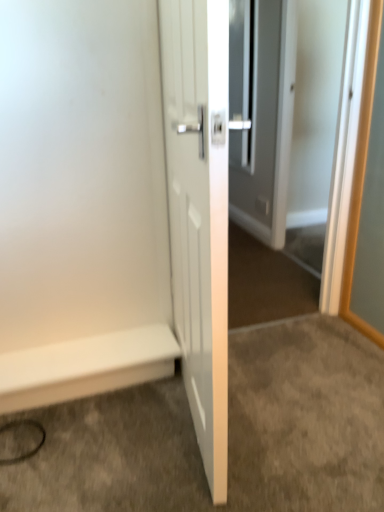
What is the approximate width of white glossy door at center?

The width of white glossy door at center is 11.45 centimeters.

Measure the distance between point (168,170) and camera.

A distance of 1.50 meters exists between point (168,170) and camera.

Measure the distance between white smooth baseboard at lower left and camera.

The distance of white smooth baseboard at lower left from camera is 4.80 feet.

Identify the location of white glossy door at center. (285, 118).

Looking at the image, does white glossy door at center seem bigger or smaller compared to white smooth baseboard at lower left?

white glossy door at center is bigger than white smooth baseboard at lower left.

Is white glossy door at center not within white smooth baseboard at lower left?

Yes.

Is white glossy door at center next to white smooth baseboard at lower left?

white glossy door at center and white smooth baseboard at lower left are clearly separated.

From a real-world perspective, is white glossy door at center beneath white smooth baseboard at lower left?

No, from a real-world perspective, white glossy door at center is not under white smooth baseboard at lower left.

Can you confirm if white glossy door at center is positioned to the right of white smooth baseboard at lower left?

Correct, you'll find white glossy door at center to the right of white smooth baseboard at lower left.

The image size is (384, 512). What are the coordinates of `screen door on the right of white smooth baseboard at lower left` in the screenshot? It's located at (285, 118).

How different are the orientations of white glossy door at center and white smooth baseboard at lower left in degrees?

The angular difference between white glossy door at center and white smooth baseboard at lower left is 180 degrees.

In the scene shown: From a real-world perspective, is white glossy door at center under white smooth baseboard at lower left?

Incorrect, from a real-world perspective, white glossy door at center is higher than white smooth baseboard at lower left.

Considering the points (277, 101) and (203, 352), which point is in front, point (277, 101) or point (203, 352)?

The point (203, 352) is more forward.

Is white glossy door at center in front of white glossy door at center?

No.

From the image's perspective, is white glossy door at center positioned above or below white glossy door at center?

Based on their image positions, white glossy door at center is located above white glossy door at center.

Is white glossy door at center oriented away from white glossy door at center?

No, white glossy door at center is not at the back of white glossy door at center.

From a real-world perspective, is white smooth baseboard at lower left over white glossy door at center?

Incorrect, from a real-world perspective, white smooth baseboard at lower left is lower than white glossy door at center.

From the picture: How different are the orientations of white smooth baseboard at lower left and white glossy door at center in degrees?

81.4 degrees.

From the image's perspective, is white smooth baseboard at lower left above white glossy door at center?

Actually, white smooth baseboard at lower left appears below white glossy door at center in the image.

Between point (43, 374) and point (202, 195), which one is positioned behind?

The point (43, 374) is farther from the camera.

Can you confirm if white smooth baseboard at lower left is shorter than white glossy door at center?

Yes, white smooth baseboard at lower left is shorter than white glossy door at center.

Is white smooth baseboard at lower left far from white glossy door at center?

white smooth baseboard at lower left is positioned a significant distance from white glossy door at center.

Could you tell me if white smooth baseboard at lower left is facing white glossy door at center?

No, white smooth baseboard at lower left is not facing towards white glossy door at center.

Measure the distance from white smooth baseboard at lower left to white glossy door at center.

white smooth baseboard at lower left and white glossy door at center are 5.41 feet apart from each other.

Looking at this image, is the surface of white glossy door at center in direct contact with white glossy door at center?

white glossy door at center is not next to white glossy door at center, and they're not touching.

From a real-world perspective, is white glossy door at center beneath white glossy door at center?

Correct, in the physical world, white glossy door at center is lower than white glossy door at center.

How different are the orientations of white glossy door at center and white glossy door at center in degrees?

They differ by 98.8 degrees in their facing directions.

From the image's perspective, which is above, white glossy door at center or white glossy door at center?

white glossy door at center.

In order to click on door on the right of white smooth baseboard at lower left in this screenshot , I will do `click(199, 212)`.

Identify the location of screen door above the white smooth baseboard at lower left (from the image's perspective). (285, 118).

Looking at the image, which one is located closer to white smooth baseboard at lower left, white glossy door at center or white glossy door at center?

white glossy door at center lies closer to white smooth baseboard at lower left than the other object.

Estimate the real-world distances between objects in this image. Which object is further from white glossy door at center, white glossy door at center or white smooth baseboard at lower left?

Among the two, white smooth baseboard at lower left is located further to white glossy door at center.

In the scene shown: Based on their spatial positions, is white smooth baseboard at lower left or white glossy door at center further from white glossy door at center?

white smooth baseboard at lower left lies further to white glossy door at center than the other object.

Which object lies further to the anchor point white glossy door at center, white smooth baseboard at lower left or white glossy door at center?

The object further to white glossy door at center is white glossy door at center.

Which object lies nearer to the anchor point white smooth baseboard at lower left, white glossy door at center or white glossy door at center?

white glossy door at center lies closer to white smooth baseboard at lower left than the other object.

When comparing their distances from white glossy door at center, does white glossy door at center or white smooth baseboard at lower left seem further?

Among the two, white glossy door at center is located further to white glossy door at center.

Identify the location of screen door between white glossy door at center and white smooth baseboard at lower left along the z-axis. This screenshot has width=384, height=512. (285, 118).